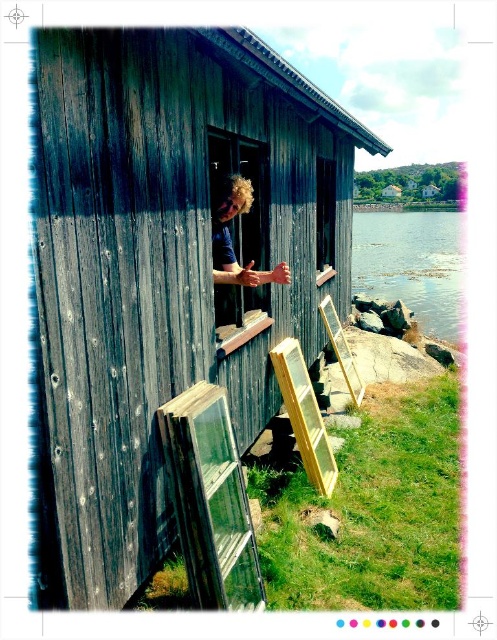
Is point (224, 145) closer to camera compared to point (350, 362)?

Yes, point (224, 145) is in front of point (350, 362).

This screenshot has width=497, height=640. What do you see at coordinates (252, 193) in the screenshot?
I see `wooden window at center` at bounding box center [252, 193].

Who is more distant from viewer, [254,163] or [325,321]?

The point [325,321] is more distant.

Where is `wooden window at center`? The image size is (497, 640). wooden window at center is located at coordinates (252, 193).

Who is taller, clear glass window at lower center or wooden plank at center?

With more height is wooden plank at center.

Is clear glass window at lower center to the right of wooden plank at center from the viewer's perspective?

No, clear glass window at lower center is not to the right of wooden plank at center.

Does point (223, 499) come behind point (333, 346)?

No, it is in front of (333, 346).

Locate an element on the screen. This screenshot has width=497, height=640. clear glass window at lower center is located at coordinates (x=210, y=499).

Between point (304, 170) and point (233, 244), which one is positioned behind?

The point (304, 170) is more distant.

Which is in front, point (58, 80) or point (240, 308)?

Point (58, 80) is in front.

Where is `weathered wood hut at center`? The width and height of the screenshot is (497, 640). weathered wood hut at center is located at coordinates (165, 269).

Locate an element on the screen. weathered wood hut at center is located at coordinates (165, 269).